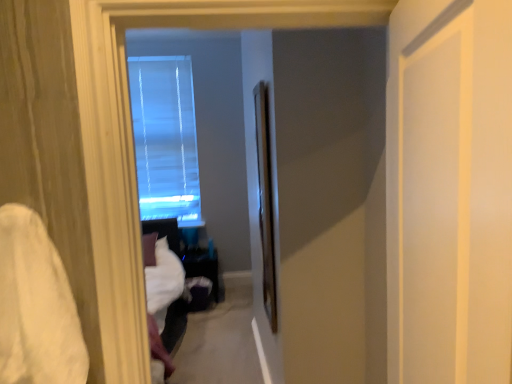
Where is `free space above transparent glass window at center (from a real-world perspective)`? This screenshot has width=512, height=384. free space above transparent glass window at center (from a real-world perspective) is located at coordinates (159, 52).